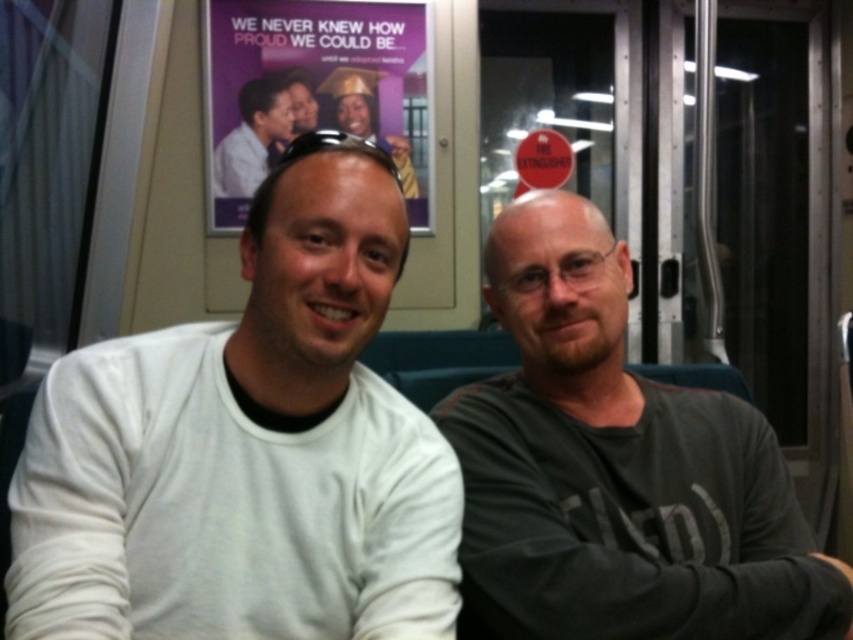
You are a fashion designer observing two shirts in an image. The first is the dark gray cotton shirt at center and the second is the matte gray shirt at upper center. Which shirt has a greater height?

The dark gray cotton shirt at center is much taller as matte gray shirt at upper center, so the dark gray cotton shirt at center has a greater height.

You are a passenger on a train and you want to know if the white matte shirt at center is taller than the purple paper poster at upper center. Can you determine this based on the scene?

The white matte shirt at center is not as tall as the purple paper poster at upper center, so the purple paper poster at upper center is taller.

You are a passenger on a train and you see the white matte shirt at center and the purple paper poster at upper center. Which object is closer to you?

The white matte shirt at center is closer to you because it is in front of the purple paper poster at upper center.